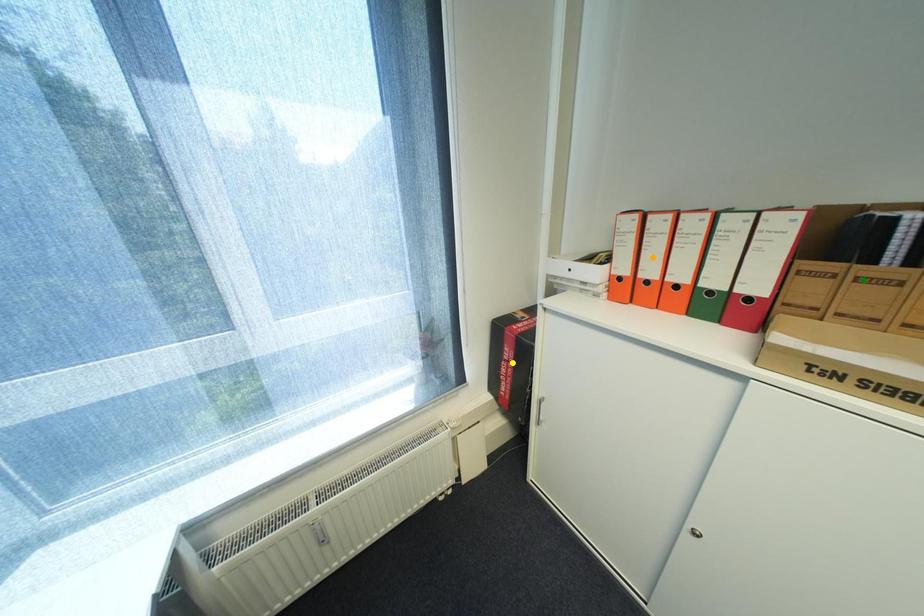
Order these from nearest to farthest:
A) yellow point
B) orange point
C) green point

green point → orange point → yellow point